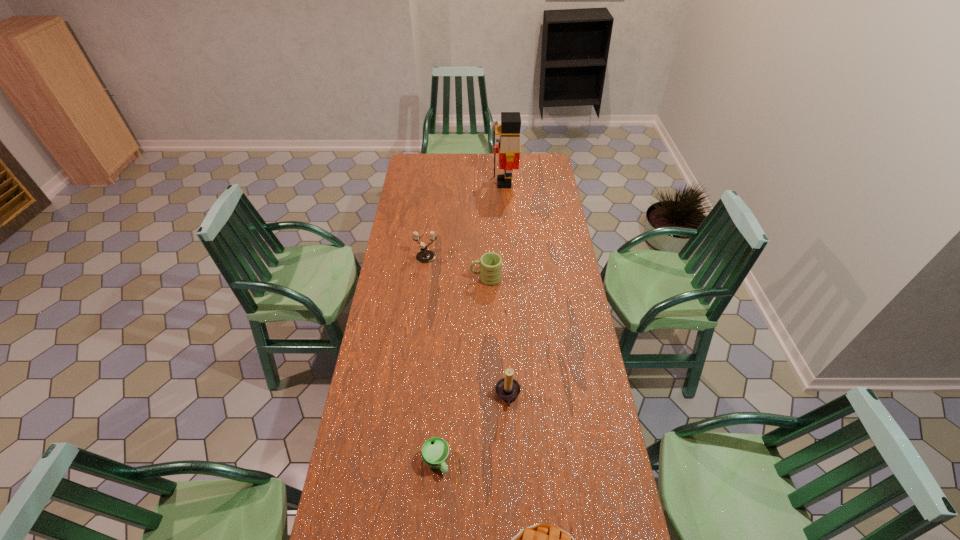
Where is `vacant region located on the right of the second shortest object`? This screenshot has height=540, width=960. vacant region located on the right of the second shortest object is located at coordinates (510, 461).

This screenshot has height=540, width=960. What are the coordinates of `object at the far edge` in the screenshot? It's located at (509, 148).

Find the location of `object that is at the left edge`. object that is at the left edge is located at coordinates (424, 256).

Locate an element on the screen. The image size is (960, 540). vacant space at the far edge of the desktop is located at coordinates (462, 161).

This screenshot has width=960, height=540. In the image, there is a desktop. In order to click on vacant area at the right edge in this screenshot , I will do `click(561, 419)`.

In the image, there is a desktop. Identify the location of free space at the far right corner. (539, 175).

The height and width of the screenshot is (540, 960). I want to click on free space between the right candle holder and the leftmost object, so click(467, 327).

At what (x,y) coordinates should I click in order to perform the action: click on vacant area that lies between the right candle holder and the left candle holder. Please return your answer as a coordinate pair (x, y). Looking at the image, I should click on pos(467,327).

You are a GUI agent. You are given a task and a screenshot of the screen. Output one action in this format:
    pyautogui.click(x=<x>, y=<y>)
    Task: Click on the free space between the tallest object and the second object from left to right
    The image size is (960, 540).
    Given the screenshot: What is the action you would take?
    pyautogui.click(x=470, y=322)

The height and width of the screenshot is (540, 960). What are the coordinates of `free space that is in between the cup and the nearer candle holder` in the screenshot? It's located at (472, 429).